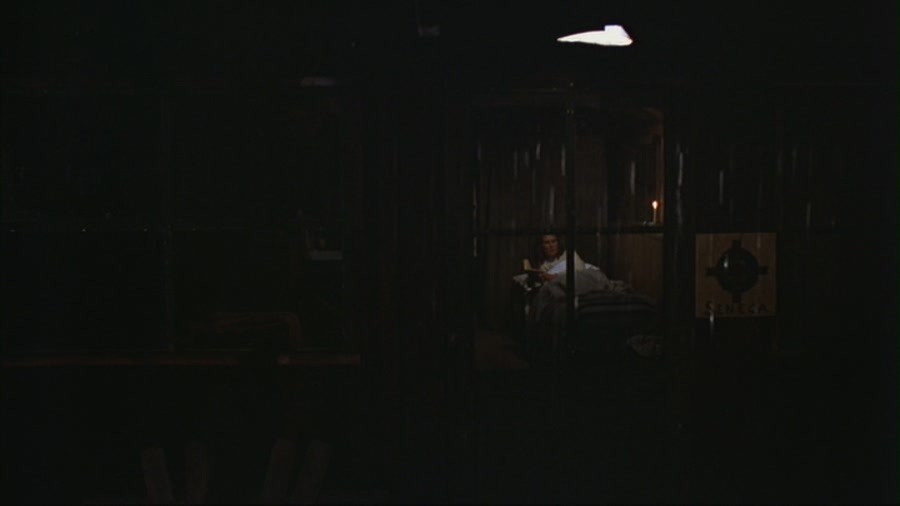
The image size is (900, 506). In order to click on book in this screenshot , I will do `click(523, 270)`.